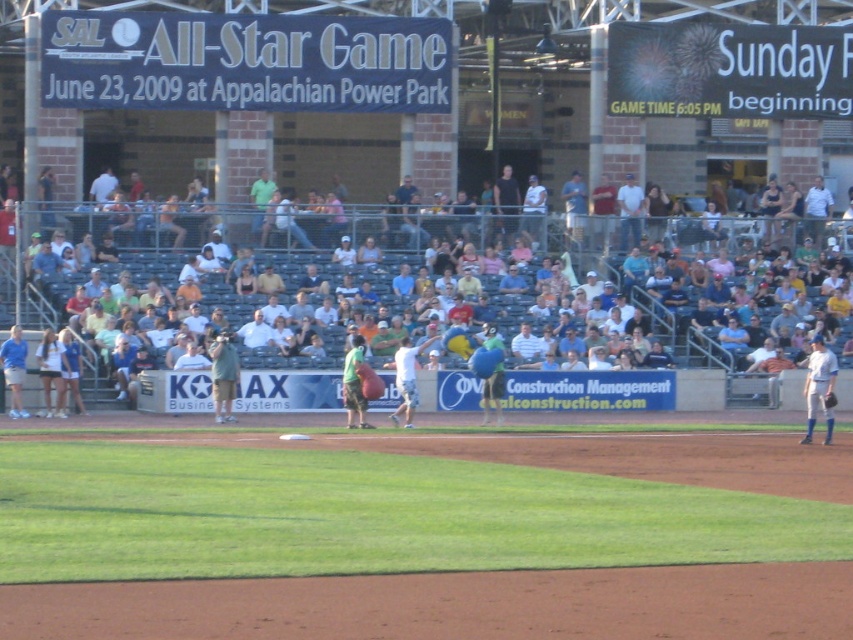
Does green fabric bag at center have a lesser height compared to dark blue leather glove at lower right?

Incorrect, green fabric bag at center's height does not fall short of dark blue leather glove at lower right's.

Does green fabric bag at center appear on the right side of dark blue leather glove at lower right?

In fact, green fabric bag at center is to the left of dark blue leather glove at lower right.

Locate an element on the screen. green fabric bag at center is located at coordinates (223, 376).

Is blue fabric bag at center to the right of dark blue leather glove at lower right from the viewer's perspective?

No, blue fabric bag at center is not to the right of dark blue leather glove at lower right.

How much distance is there between blue fabric bag at center and dark blue leather glove at lower right?

They are 15.77 meters apart.

Does point (560, 195) come farther from viewer compared to point (831, 403)?

Yes, point (560, 195) is farther from viewer.

Image resolution: width=853 pixels, height=640 pixels. Find the location of `blue fabric bag at center`. blue fabric bag at center is located at coordinates (573, 205).

Does black matte shirt at upper center have a lesser width compared to dark blue leather glove at lower right?

In fact, black matte shirt at upper center might be wider than dark blue leather glove at lower right.

Which is in front, point (517, 212) or point (828, 403)?

Point (828, 403) is in front.

Image resolution: width=853 pixels, height=640 pixels. I want to click on black matte shirt at upper center, so click(506, 202).